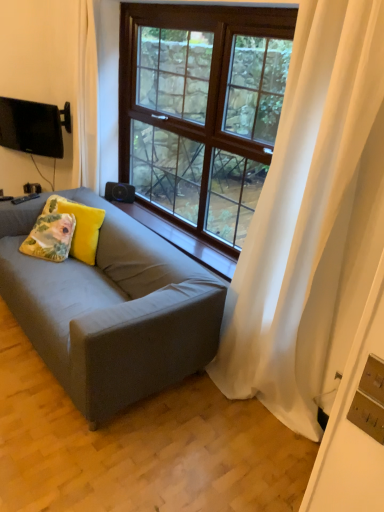
Question: From a real-world perspective, is floral fabric cushion at center, which ranks as the 2th pillow in left-to-right order, on matte gray couch at center?

Choices:
 (A) yes
 (B) no

Answer: (A)

Question: Considering the relative sizes of floral fabric cushion at center, which ranks as the 2th pillow in left-to-right order, and matte gray couch at center in the image provided, is floral fabric cushion at center, which ranks as the 2th pillow in left-to-right order, thinner than matte gray couch at center?

Choices:
 (A) yes
 (B) no

Answer: (A)

Question: Is floral fabric cushion at center, the first pillow in the right-to-left sequence, shorter than matte gray couch at center?

Choices:
 (A) yes
 (B) no

Answer: (A)

Question: Is floral fabric cushion at center, which ranks as the 2th pillow in left-to-right order, wider than matte gray couch at center?

Choices:
 (A) yes
 (B) no

Answer: (B)

Question: Is floral fabric cushion at center, the first pillow in the right-to-left sequence, touching matte gray couch at center?

Choices:
 (A) yes
 (B) no

Answer: (B)

Question: From their relative heights in the image, would you say matte black tv at upper left is taller or shorter than floral fabric cushion at center, the first pillow in the right-to-left sequence?

Choices:
 (A) short
 (B) tall

Answer: (B)

Question: From the image's perspective, is matte black tv at upper left positioned above or below floral fabric cushion at center, which ranks as the 2th pillow in left-to-right order?

Choices:
 (A) below
 (B) above

Answer: (B)

Question: Visually, is matte black tv at upper left positioned to the left or to the right of floral fabric cushion at center, which ranks as the 2th pillow in left-to-right order?

Choices:
 (A) left
 (B) right

Answer: (A)

Question: In the image, is matte black tv at upper left positioned in front of or behind floral fabric cushion at center, the first pillow in the right-to-left sequence?

Choices:
 (A) front
 (B) behind

Answer: (B)

Question: Looking at their shapes, would you say wooden at center is wider or thinner than matte black tv at upper left?

Choices:
 (A) thin
 (B) wide

Answer: (B)

Question: From a real-world perspective, is wooden at center positioned above or below matte black tv at upper left?

Choices:
 (A) above
 (B) below

Answer: (B)

Question: Relative to matte black tv at upper left, is wooden at center in front or behind?

Choices:
 (A) behind
 (B) front

Answer: (B)

Question: From their relative heights in the image, would you say wooden at center is taller or shorter than matte black tv at upper left?

Choices:
 (A) short
 (B) tall

Answer: (A)

Question: From the image's perspective, relative to wooden at center, is floral fabric pillow at left, the 2th pillow when ordered from right to left, above or below?

Choices:
 (A) above
 (B) below

Answer: (B)

Question: From their relative heights in the image, would you say floral fabric pillow at left, the 2th pillow when ordered from right to left, is taller or shorter than wooden at center?

Choices:
 (A) tall
 (B) short

Answer: (A)